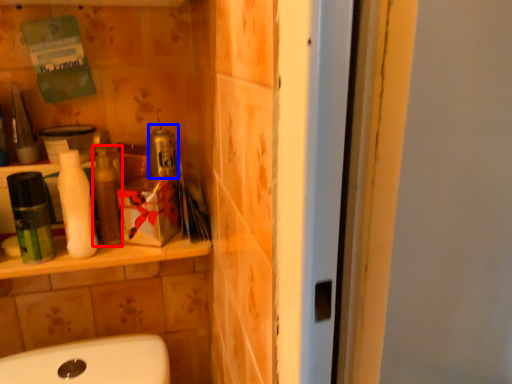
Question: Which point is further to the camera, toiletry (highlighted by a red box) or product (highlighted by a blue box)?

Choices:
 (A) toiletry
 (B) product

Answer: (B)